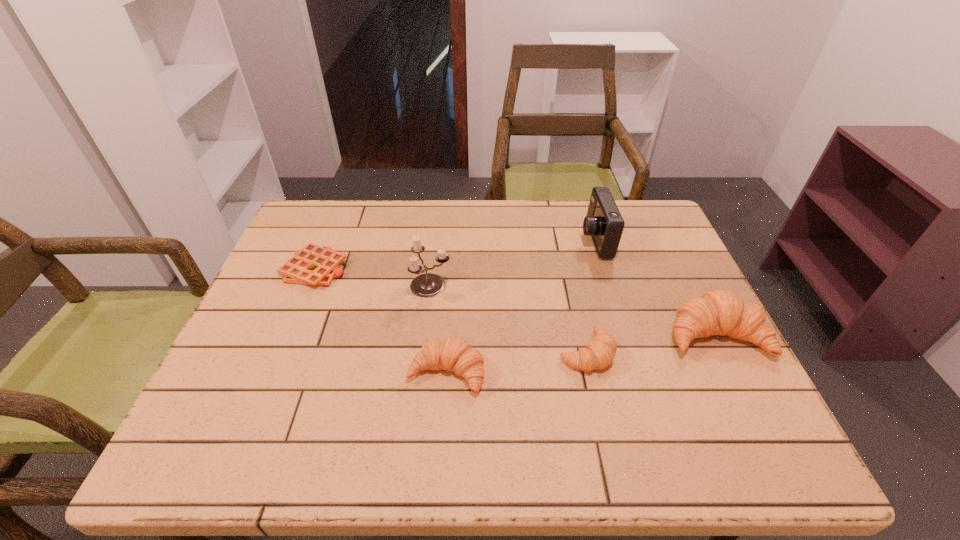
Please point a spot on the left to add another crescent roll. Please provide its 2D coordinates. Your answer should be formatted as a tuple, i.e. [(x, y)], where the tuple contains the x and y coordinates of a point satisfying the conditions above.

[(295, 393)]